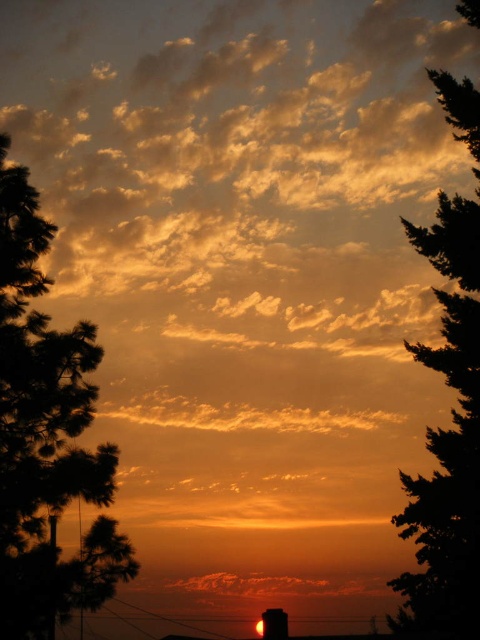
Can you confirm if green leafy tree at left is smaller than green leafy tree at right?

No.

Does green leafy tree at left appear under green leafy tree at right?

No.

Who is more forward, [32,634] or [442,227]?

Point [32,634] is in front.

Where is `green leafy tree at left`? green leafy tree at left is located at coordinates (46, 436).